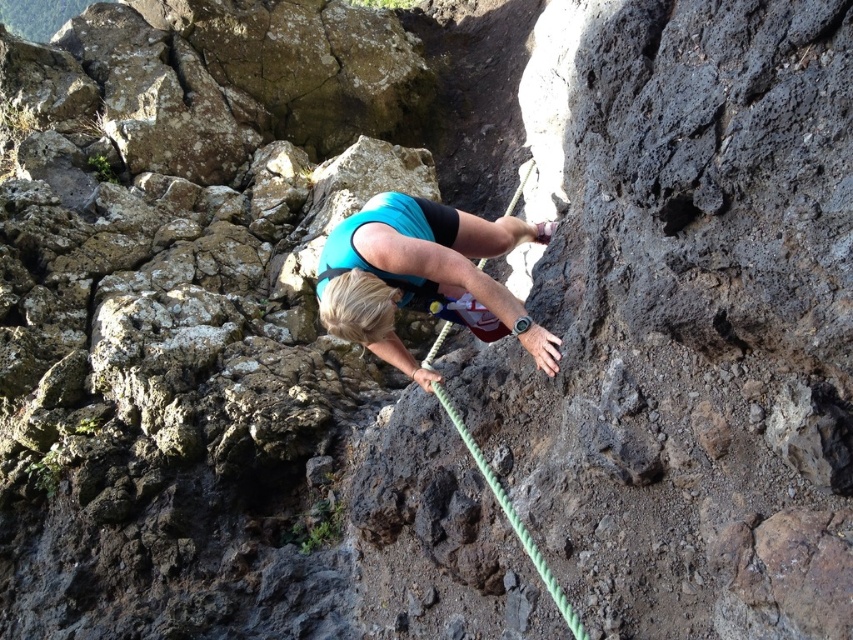
Looking at this image, you are a safety inspector checking the climbing gear setup. You notice the blue fabric climber at center and the green rope at center. Which object has a greater width according to the safety guidelines?

The blue fabric climber at center has a greater width than the green rope at center according to the safety guidelines.

You are a safety inspector checking the climbing site. You notice the blue fabric climber at center and the green rope at center. According to safety regulations, the maximum allowed distance between a climber and their safety rope should not exceed 24 inches. Is the current distance compliant with the regulation?

The blue fabric climber at center is 22.99 inches from the green rope at center, which is within the 24 inches safety regulation limit. Therefore, the current distance is compliant with the regulation.

You are a rock climber trying to reach the top of the cliff. You see two points marked on the cliff face. The first point is at coordinates point (318,317) and the second point is at point (479,467). Which point is closer to your current position if you are facing the cliff?

Point (479,467) is closer to your current position because point (318,317) is behind it according to the coordinates provided.